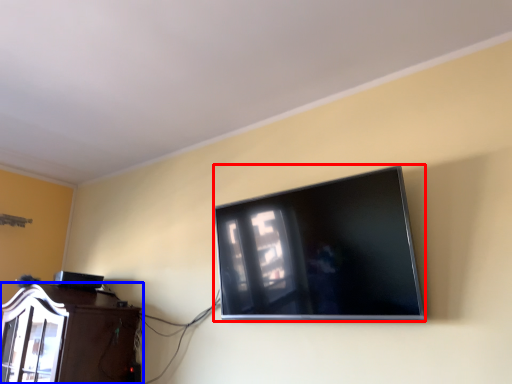
Question: Which of the following is the farthest to the observer, television (highlighted by a red box) or furniture (highlighted by a blue box)?

Choices:
 (A) television
 (B) furniture

Answer: (B)